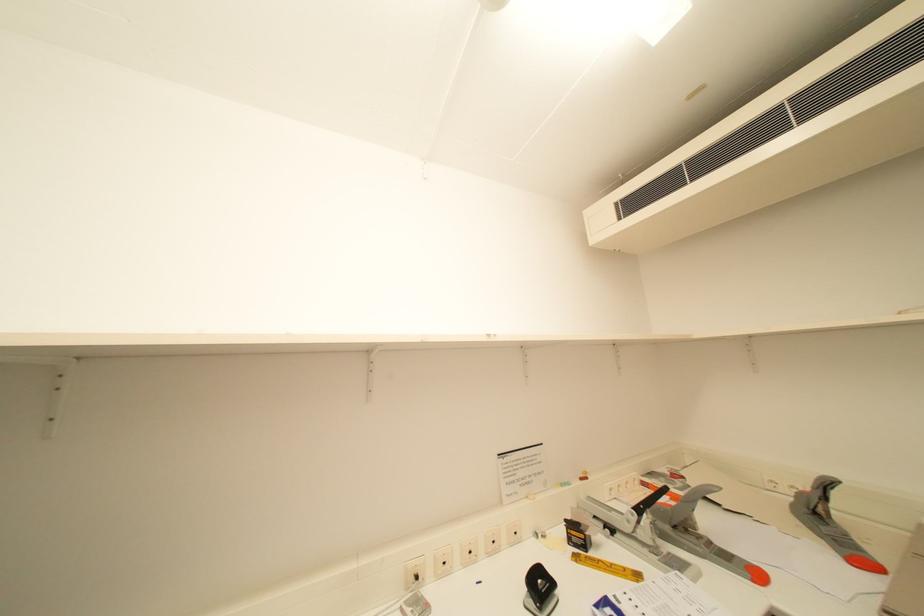
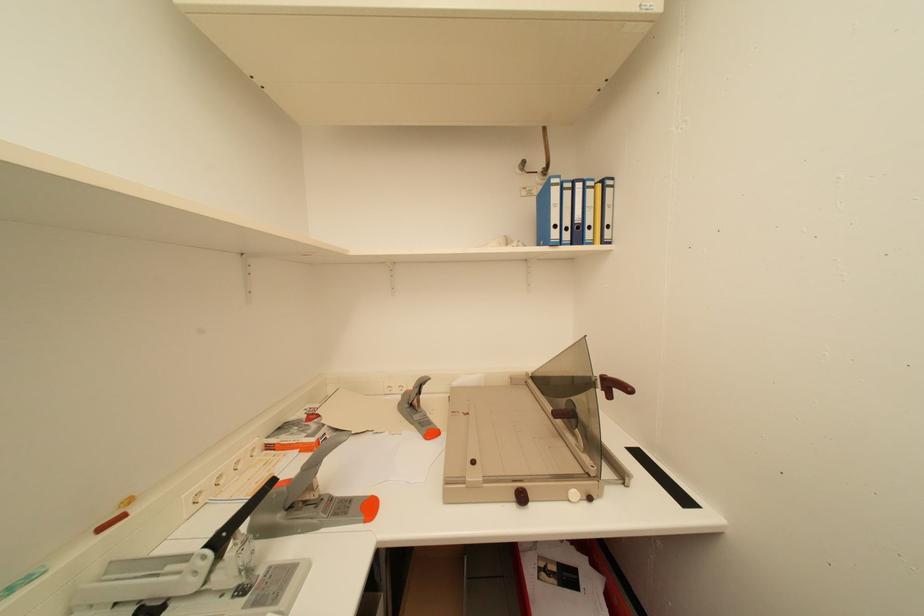
Question: The camera is either moving clockwise (left) or counter-clockwise (right) around the object. The first image is from the beginning of the video and the second image is from the end. Is the camera moving left or right when shooting the video?

Choices:
 (A) Left
 (B) Right

Answer: (A)